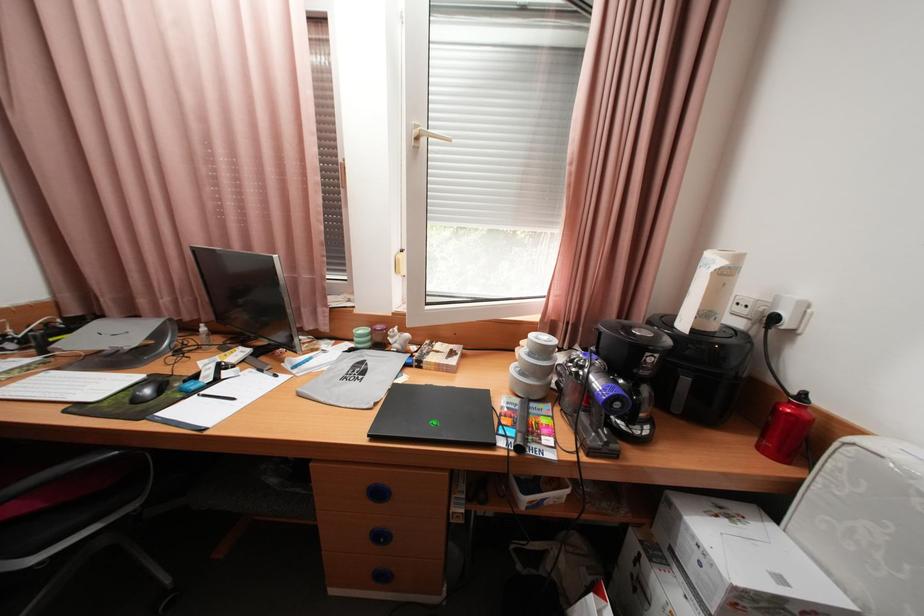
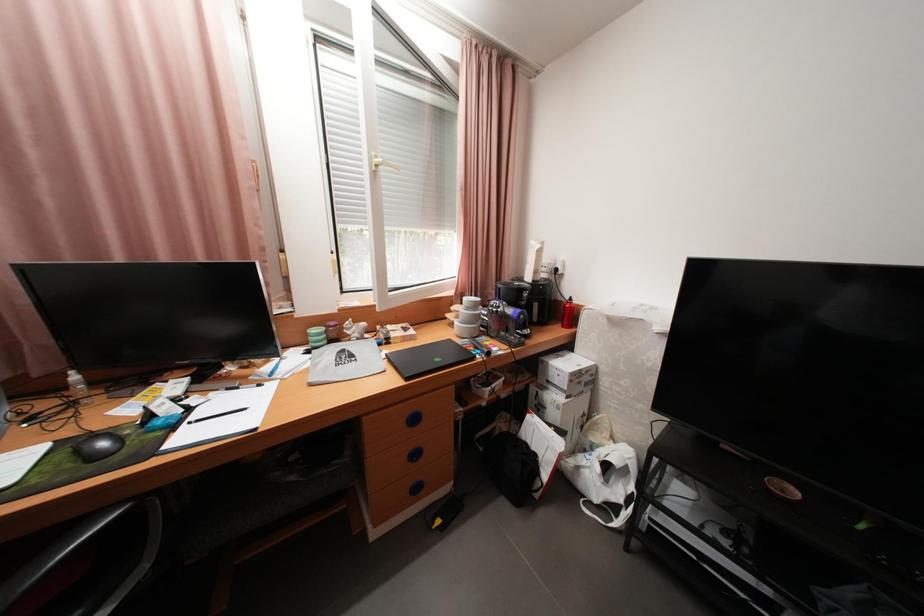
Question: Based on the continuous images, in which direction is the camera rotating? Reply with the corresponding letter.

Choices:
 (A) Left
 (B) Right
 (C) Up
 (D) Down

Answer: (B)